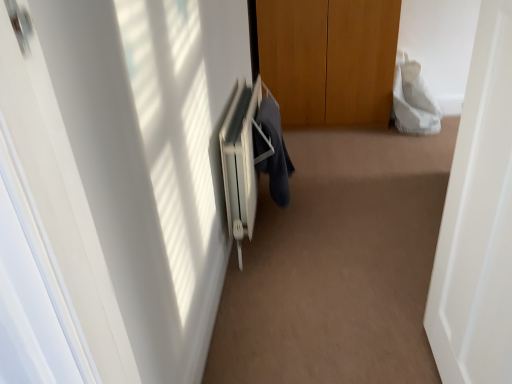
Question: Which direction should I rotate to look at dark blue fabric at center, the 2th robe in the back-to-front sequence, — up or down?

Choices:
 (A) down
 (B) up

Answer: (B)

Question: Is white textured towel at upper right, acting as the second robe starting from the front, further to the viewer compared to dark blue fabric at center, which is the 1th robe in front-to-back order?

Choices:
 (A) yes
 (B) no

Answer: (A)

Question: Is white textured towel at upper right, which is the 2th robe from left to right, to the left of dark blue fabric at center, which is the 1th robe in front-to-back order, from the viewer's perspective?

Choices:
 (A) no
 (B) yes

Answer: (A)

Question: Does white textured towel at upper right, which is the 2th robe from left to right, have a greater width compared to dark blue fabric at center, which ranks as the 2th robe in top-to-bottom order?

Choices:
 (A) yes
 (B) no

Answer: (A)

Question: Is white textured towel at upper right, the second robe ordered from the bottom, far from dark blue fabric at center, which ranks as the 2th robe in top-to-bottom order?

Choices:
 (A) yes
 (B) no

Answer: (A)

Question: Can you confirm if white textured towel at upper right, acting as the second robe starting from the front, is positioned to the right of dark blue fabric at center, the first robe from the bottom?

Choices:
 (A) yes
 (B) no

Answer: (A)

Question: Is white textured towel at upper right, acting as the second robe starting from the front, not within dark blue fabric at center, which ranks as the 2th robe in top-to-bottom order?

Choices:
 (A) yes
 (B) no

Answer: (A)

Question: Is white plastic radiator at center smaller than white textured towel at upper right, which is the 2th robe from left to right?

Choices:
 (A) no
 (B) yes

Answer: (A)

Question: Is white plastic radiator at center aimed at white textured towel at upper right, the 1th robe in the top-to-bottom sequence?

Choices:
 (A) no
 (B) yes

Answer: (A)

Question: Can you confirm if white plastic radiator at center is positioned to the right of white textured towel at upper right, acting as the second robe starting from the front?

Choices:
 (A) yes
 (B) no

Answer: (B)

Question: Is white plastic radiator at center beside white textured towel at upper right, which is the 2th robe from left to right?

Choices:
 (A) yes
 (B) no

Answer: (B)

Question: Is white plastic radiator at center not within white textured towel at upper right, the second robe ordered from the bottom?

Choices:
 (A) yes
 (B) no

Answer: (A)

Question: Can you confirm if white plastic radiator at center is positioned to the left of white textured towel at upper right, which is the 2th robe from left to right?

Choices:
 (A) yes
 (B) no

Answer: (A)

Question: Can you confirm if white textured towel at upper right, the second robe ordered from the bottom, is shorter than white plastic radiator at center?

Choices:
 (A) yes
 (B) no

Answer: (A)